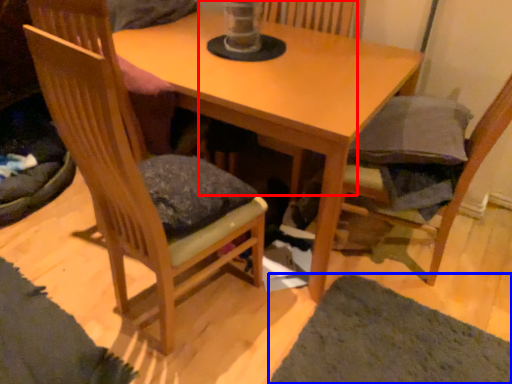
Question: Which object is further to the camera taking this photo, swivel chair (highlighted by a red box) or mat (highlighted by a blue box)?

Choices:
 (A) swivel chair
 (B) mat

Answer: (A)